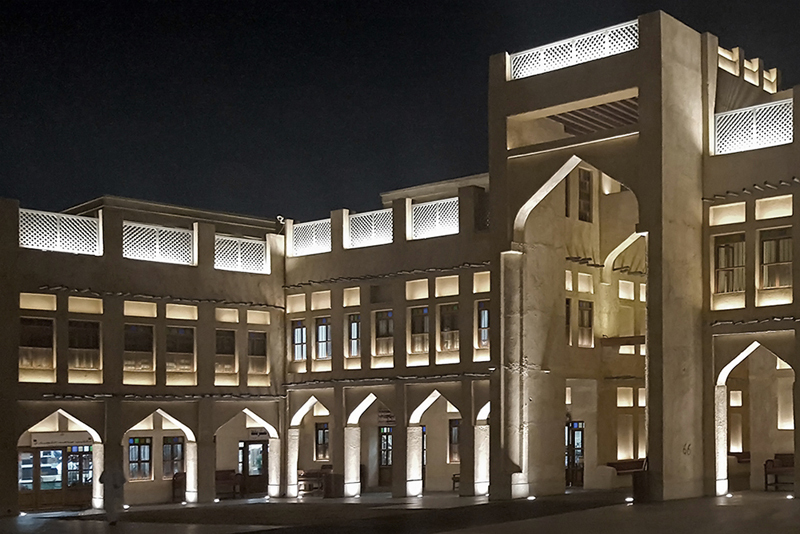
The height and width of the screenshot is (534, 800). In order to click on large entrance in this screenshot , I will do `click(612, 500)`.